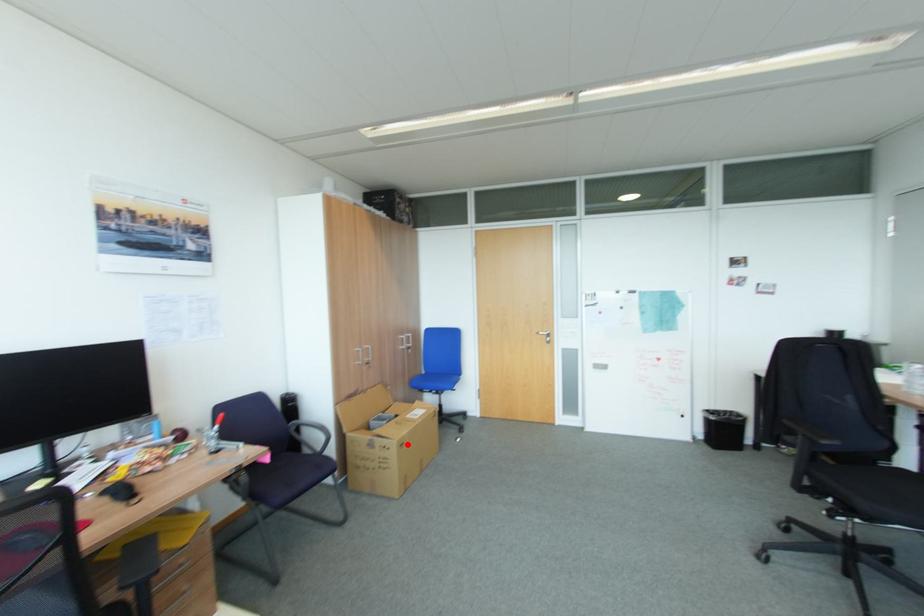
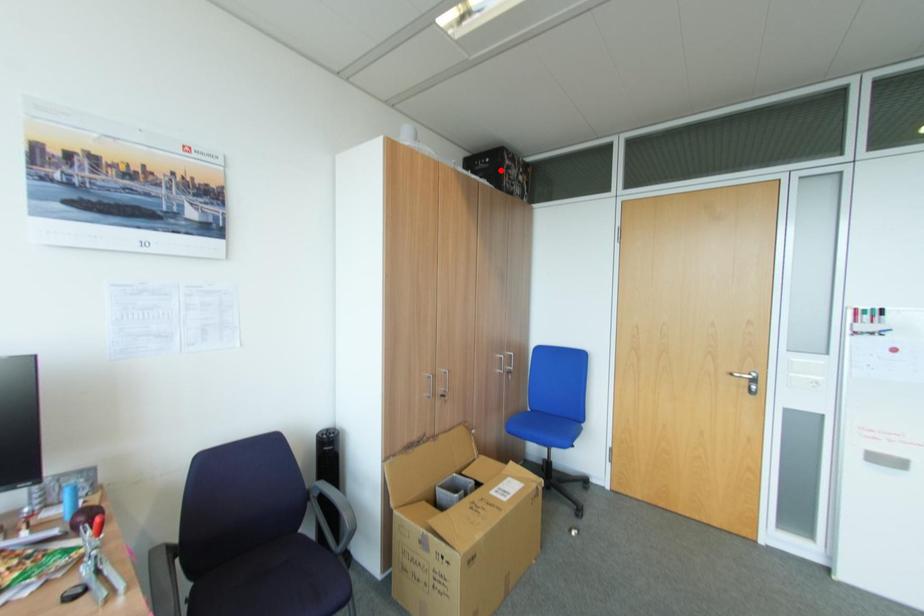
I am providing you with two images of the same scene from different viewpoints. A red point is marked on the first image and another point is marked on the second image. Is the red point in image1 aligned with the point shown in image2?

No